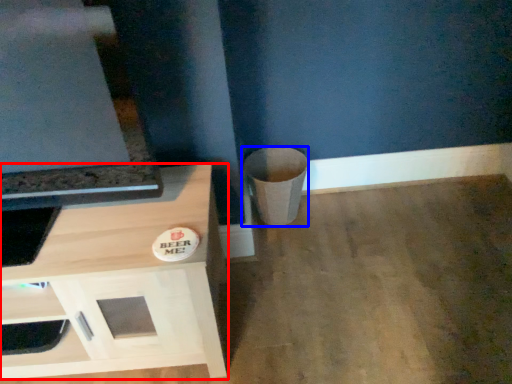
Question: Which of the following is the closest to the observer, cabinetry (highlighted by a red box) or trash bin/can (highlighted by a blue box)?

Choices:
 (A) cabinetry
 (B) trash bin/can

Answer: (A)